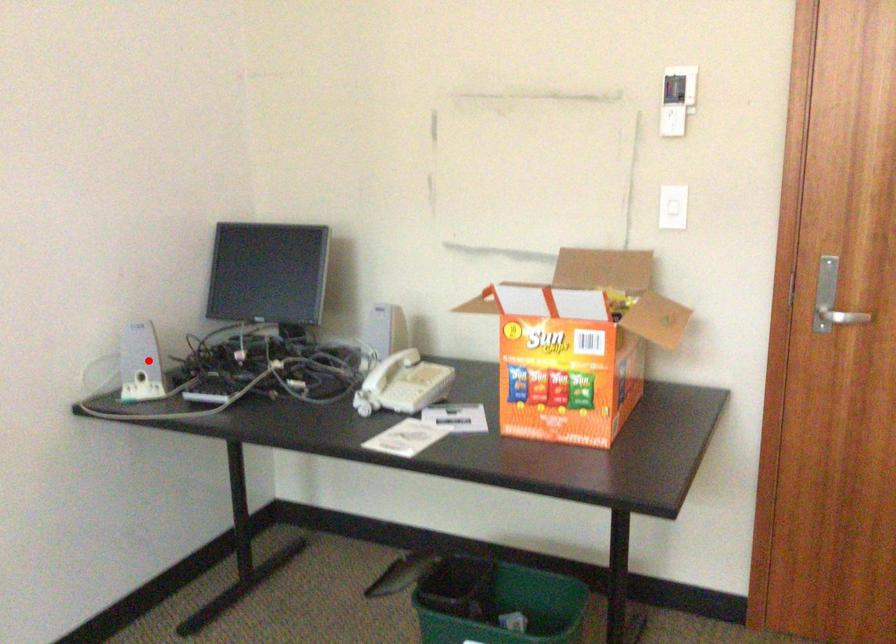
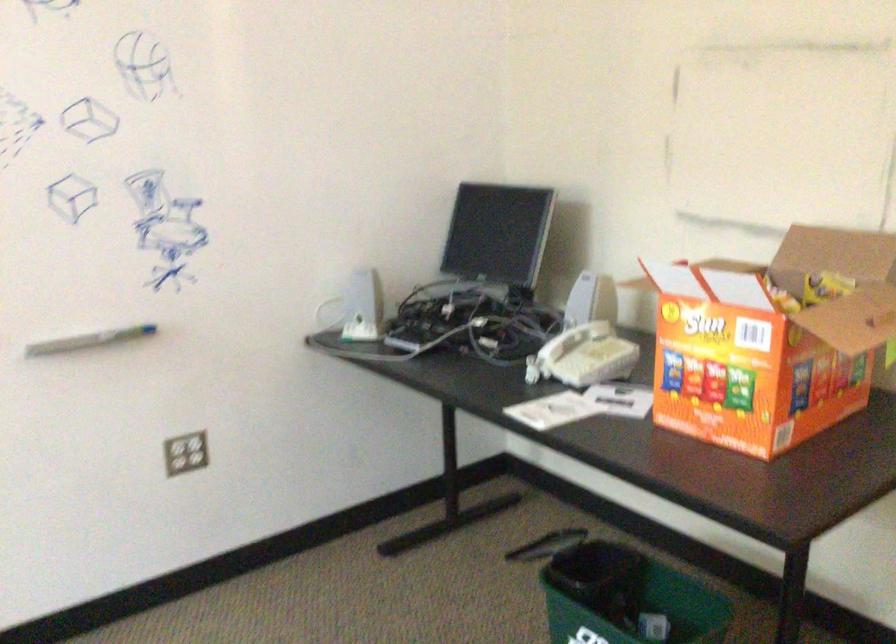
Where in the second image is the point corresponding to the highlighted location from the first image?

(355, 308)